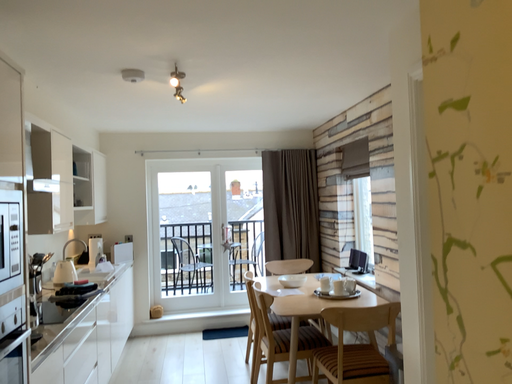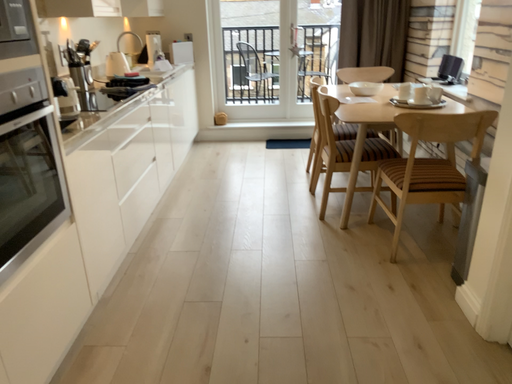
Question: Which way did the camera rotate in the video?

Choices:
 (A) rotated upward
 (B) rotated downward

Answer: (B)